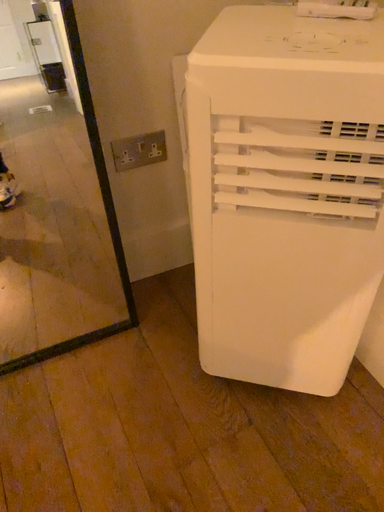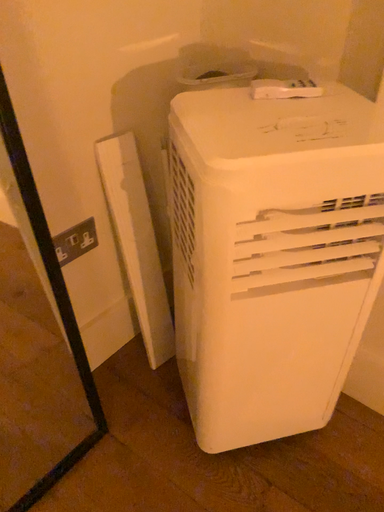
Question: Which way did the camera rotate in the video?

Choices:
 (A) rotated left
 (B) rotated right

Answer: (B)